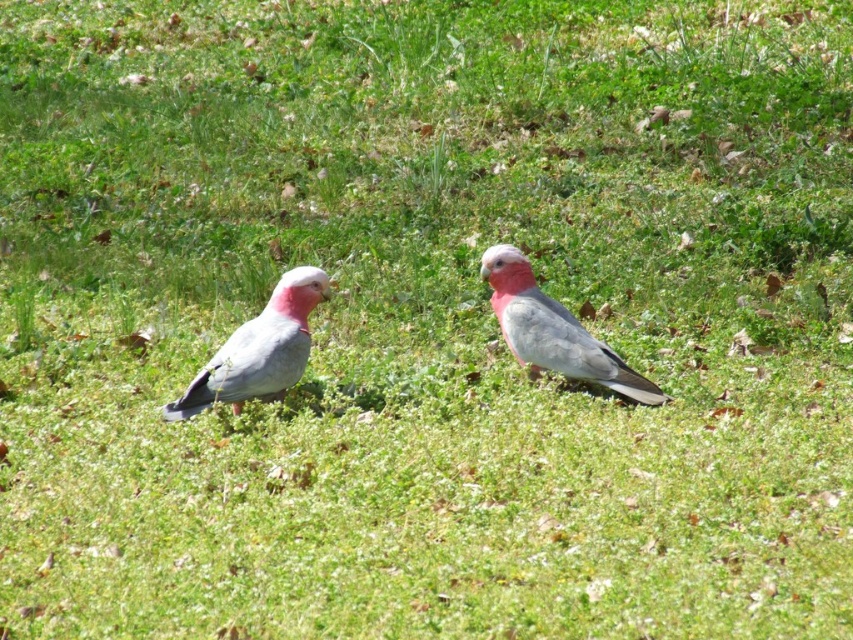
Between matte gray bird at center and pink feathered parrot at center, which one appears on the right side from the viewer's perspective?

From the viewer's perspective, pink feathered parrot at center appears more on the right side.

This screenshot has width=853, height=640. In order to click on matte gray bird at center in this screenshot , I will do `click(259, 349)`.